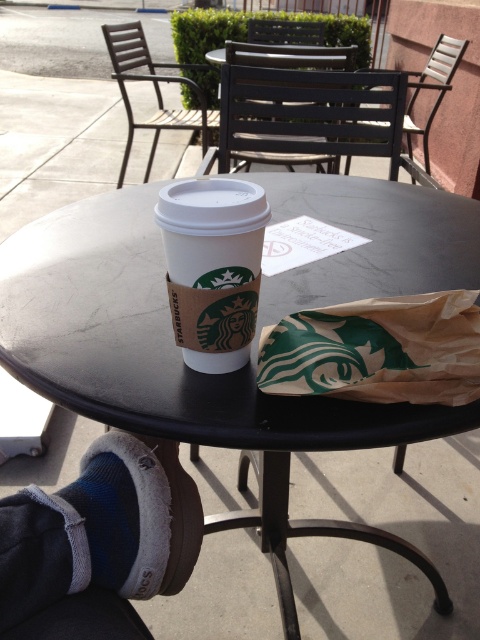
Is point (297, 108) behind point (118, 180)?

No, (297, 108) is closer to viewer.

Who is more distant from viewer, (319, 80) or (122, 65)?

Point (122, 65)

The image size is (480, 640). I want to click on matte black chair at center, so click(307, 116).

Between black matte round table at center and wooden slats chair at upper right, which one has less height?

Standing shorter between the two is black matte round table at center.

Is black matte round table at center thinner than wooden slats chair at upper right?

No.

Find the location of a particular element. This screenshot has height=640, width=480. black matte round table at center is located at coordinates coord(163,352).

Does black matte round table at center have a greater height compared to gray fleece socks at lower left?

Yes.

Who is more distant from viewer, (78,397) or (10,593)?

The point (78,397) is more distant.

Which is behind, point (139, 317) or point (67, 492)?

The point (139, 317) is behind.

Where is `black matte round table at center`? This screenshot has width=480, height=640. black matte round table at center is located at coordinates (163, 352).